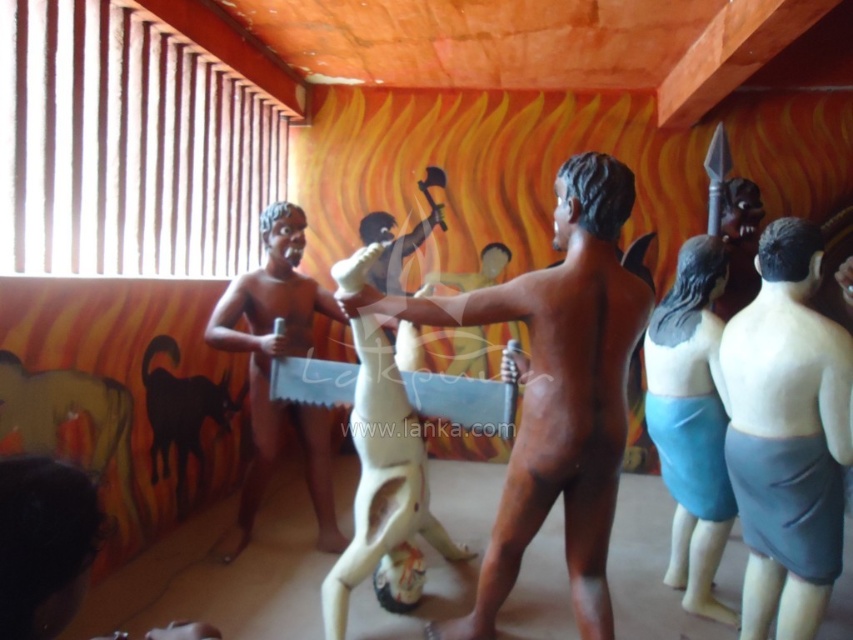
Does brown matte statue at center have a greater width compared to gray matte skirt at center?

Correct, the width of brown matte statue at center exceeds that of gray matte skirt at center.

Does brown matte statue at center have a lesser height compared to gray matte skirt at center?

In fact, brown matte statue at center may be taller than gray matte skirt at center.

What are the coordinates of `brown matte statue at center` in the screenshot? It's located at (556, 390).

Is the position of brown matte statue at center more distant than that of matte plastic man at center?

That is False.

Is point (596, 220) positioned behind point (264, 246)?

No, (596, 220) is closer to viewer.

Where is `brown matte statue at center`? brown matte statue at center is located at coordinates (556, 390).

Does blue fabric skirt at center have a greater width compared to matte plastic man at center?

Incorrect, blue fabric skirt at center's width does not surpass matte plastic man at center's.

Is blue fabric skirt at center further to the viewer compared to matte plastic man at center?

No.

Does point (711, 445) come farther from viewer compared to point (299, 404)?

No, it is not.

What are the coordinates of `blue fabric skirt at center` in the screenshot? It's located at (691, 422).